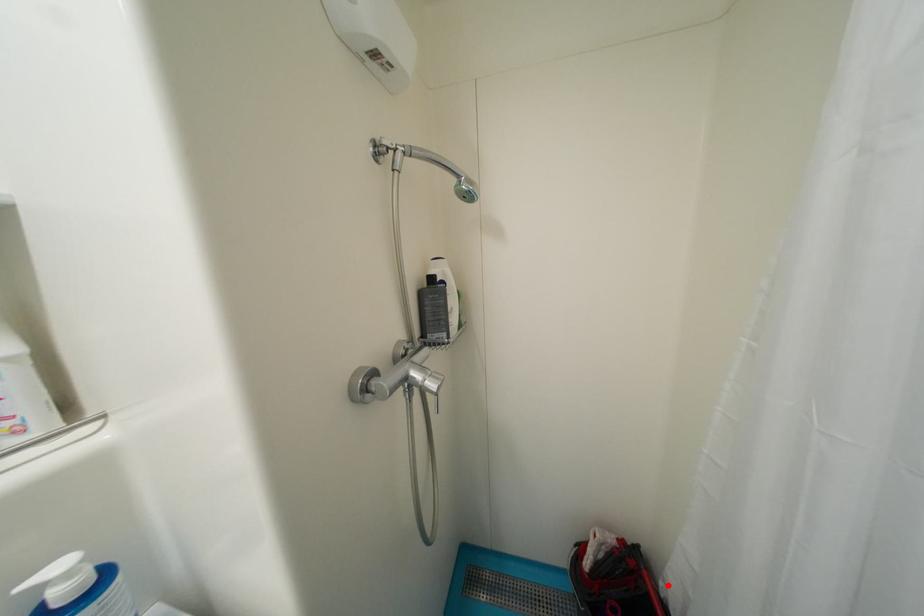
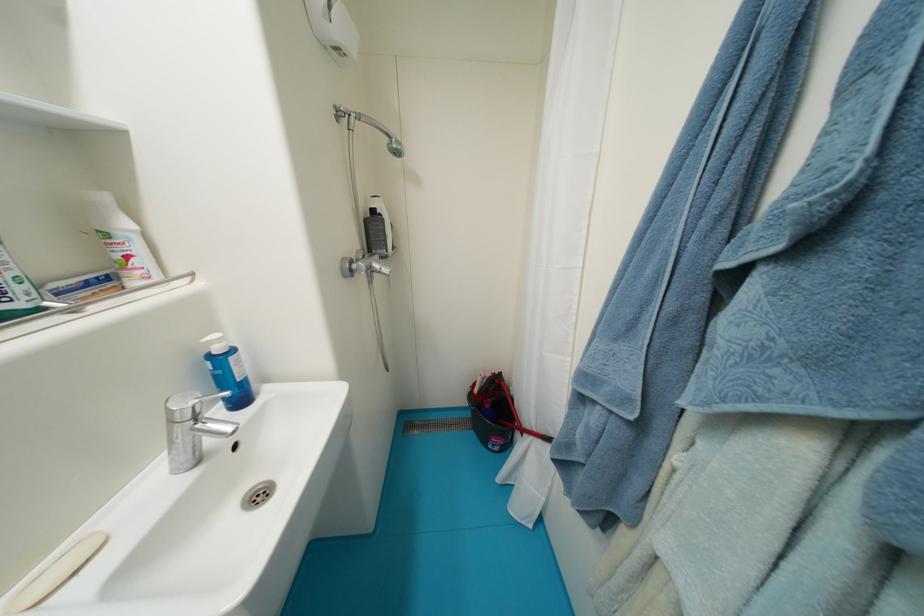
Locate, in the second image, the point that corresponds to the highlighted location in the first image.

(517, 390)